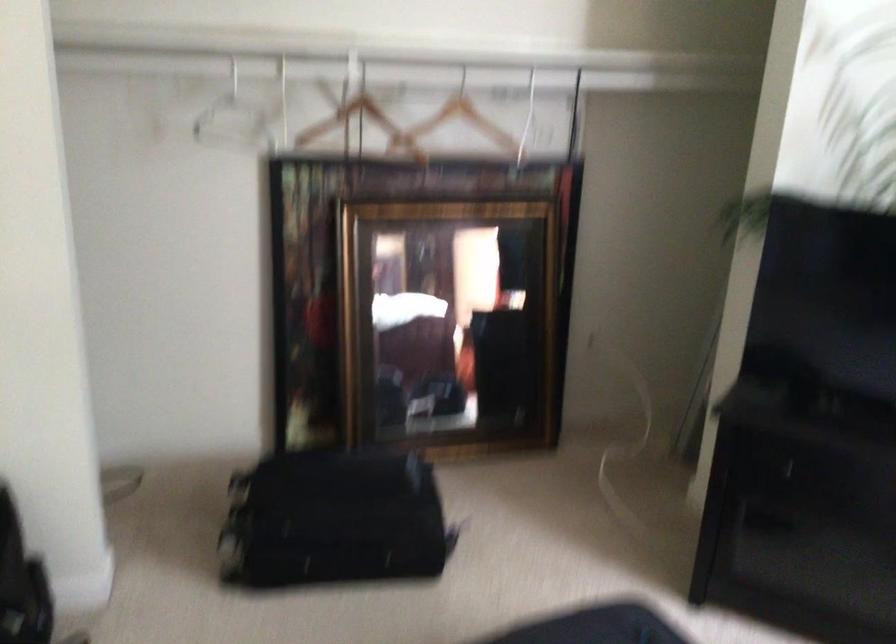
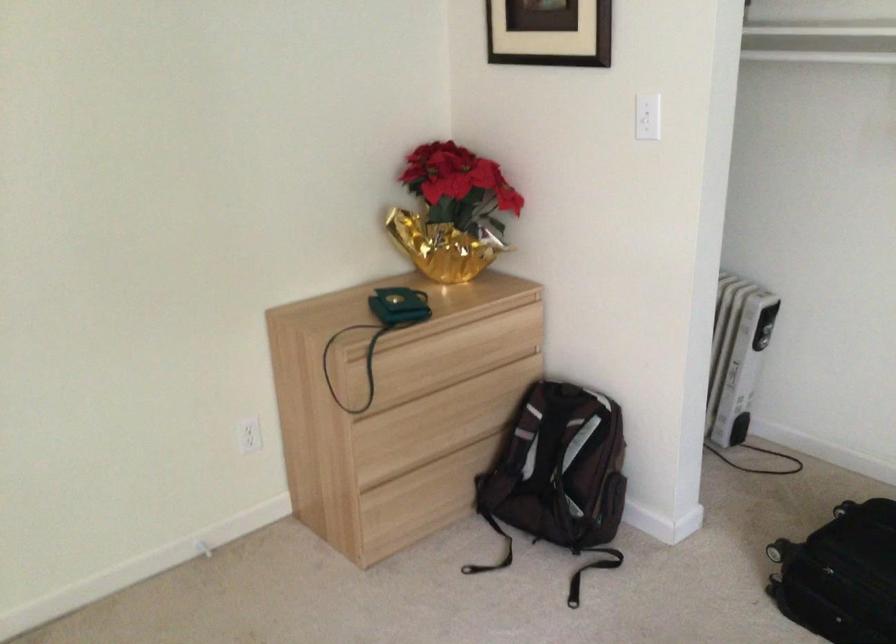
Where in the second image is the point corresponding to [99,368] from the first image?

(761, 339)